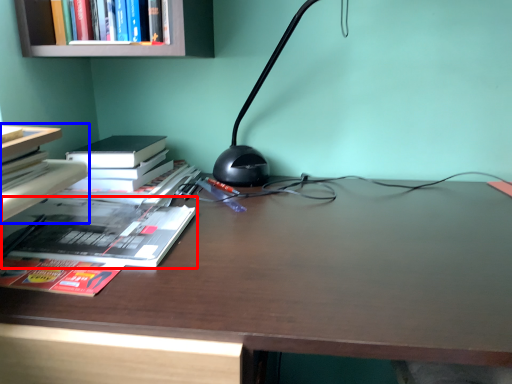
Question: Which point is closer to the camera, book (highlighted by a red box) or book (highlighted by a blue box)?

Choices:
 (A) book
 (B) book

Answer: (B)